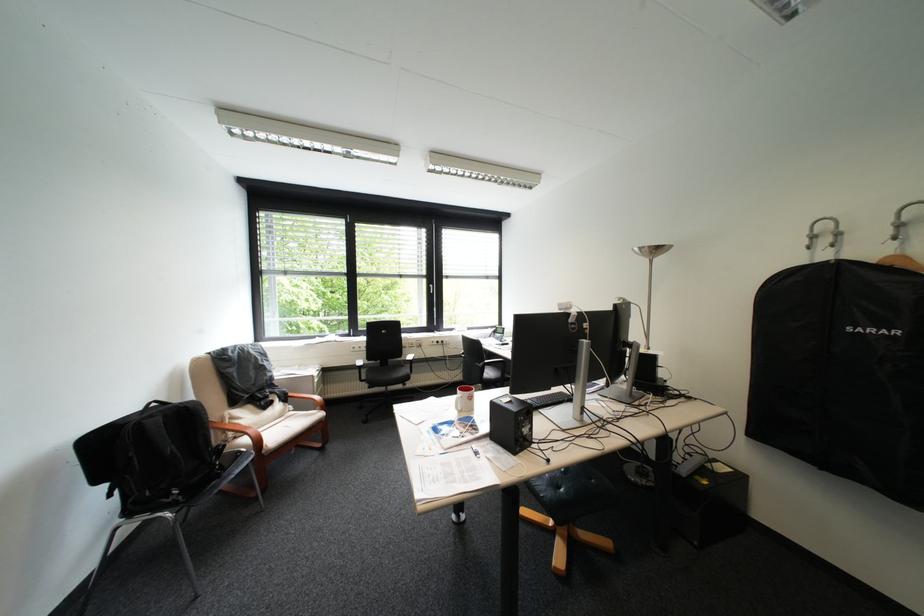
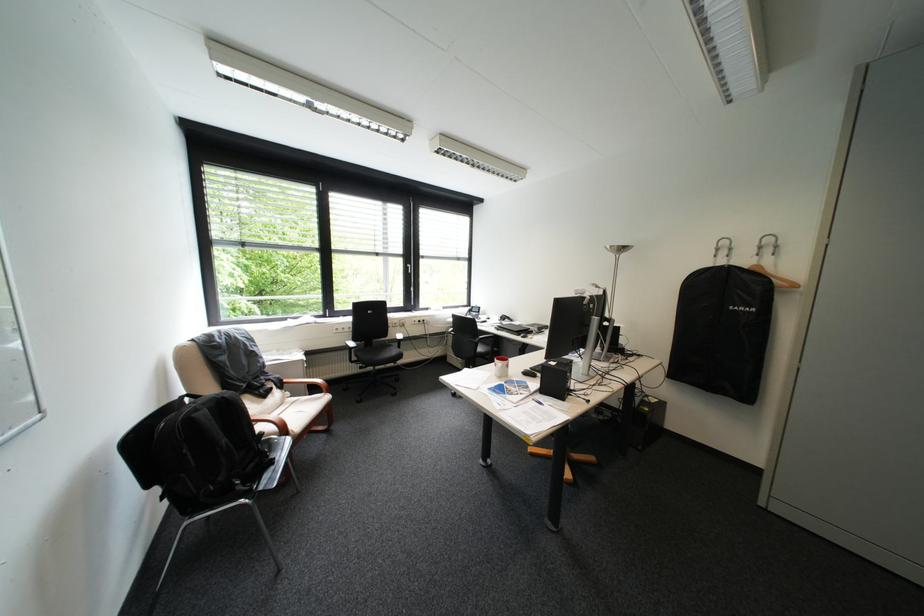
Locate, in the second image, the point that corresponds to point (883, 331) in the first image.

(755, 309)